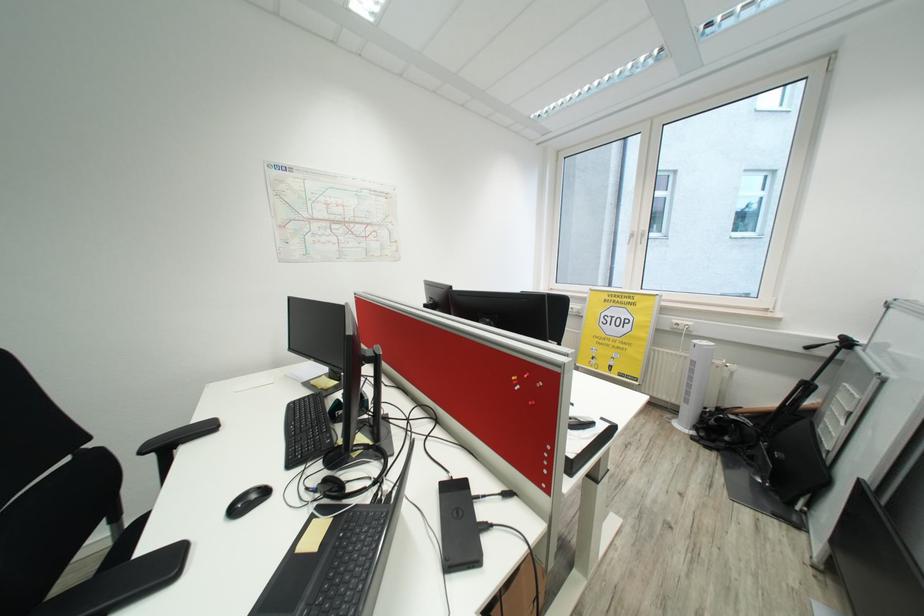
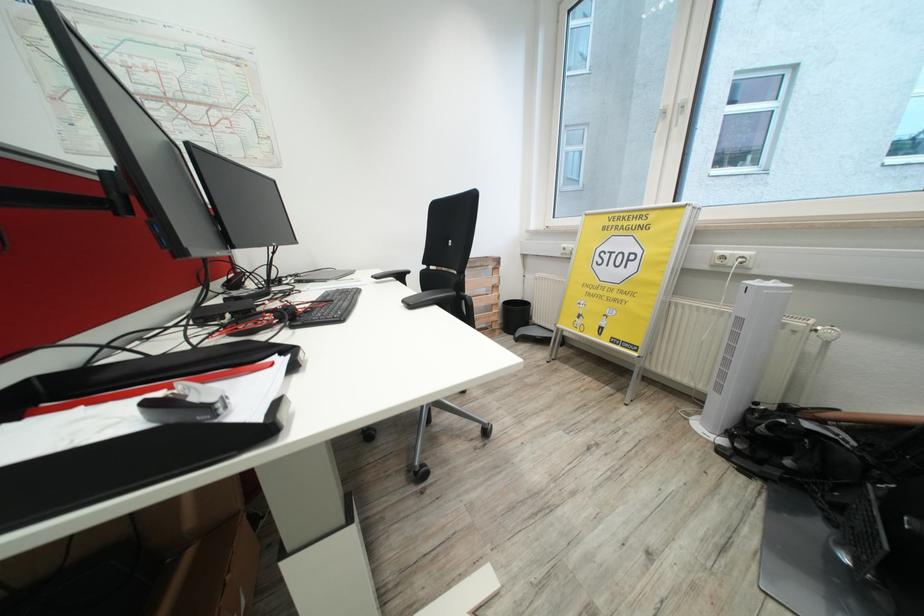
The images are taken continuously from a first-person perspective. In which direction are you moving?

The cameraman walked toward right, forward.